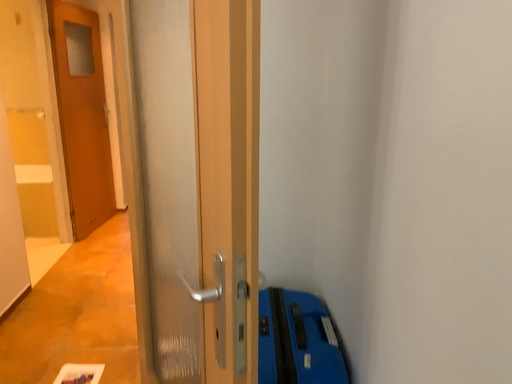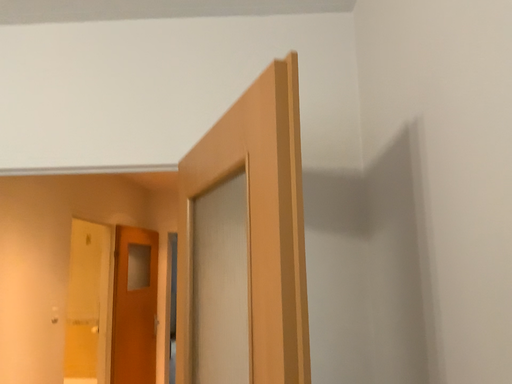
Question: Which way did the camera rotate in the video?

Choices:
 (A) rotated upward
 (B) rotated downward

Answer: (A)